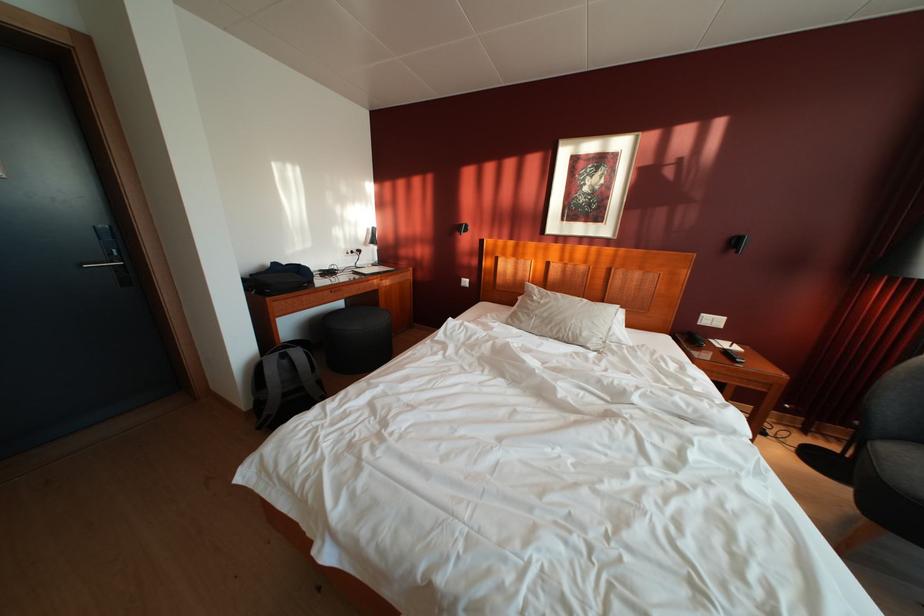
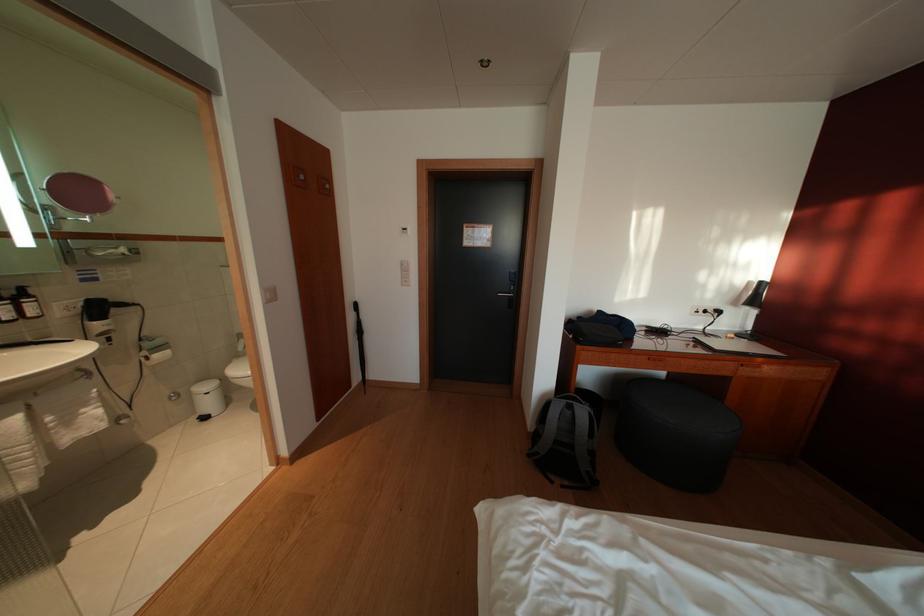
Question: How did the camera likely rotate?

Choices:
 (A) Left
 (B) Right
 (C) Up
 (D) Down

Answer: (A)